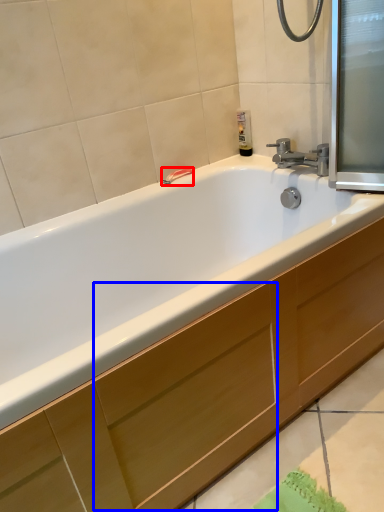
Question: Among these objects, which one is farthest to the camera, towel bar (highlighted by a red box) or drawer (highlighted by a blue box)?

Choices:
 (A) towel bar
 (B) drawer

Answer: (A)